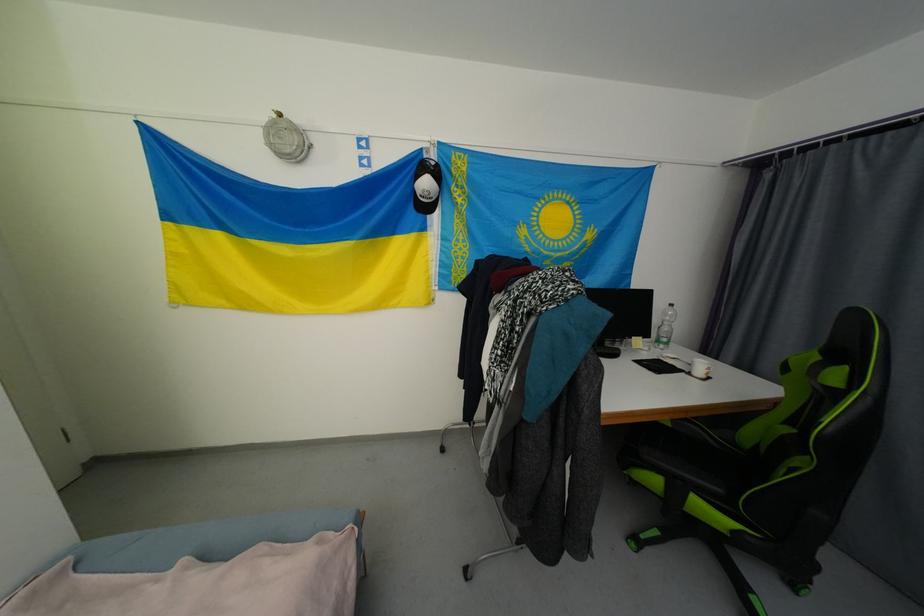
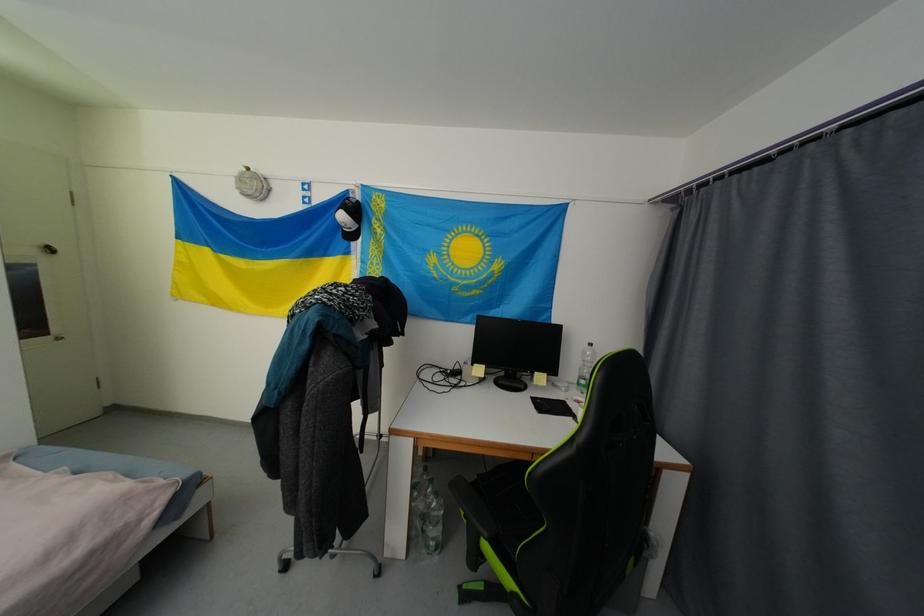
Find the pixel in the second image that matches point 663,344 in the first image.

(584, 386)